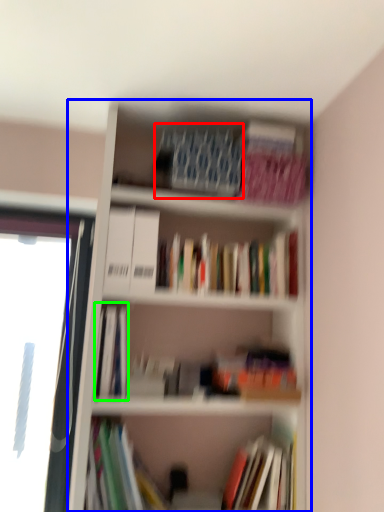
Question: Which is farther away from paperback book (highlighted by a red box)? bookcase (highlighted by a blue box) or book (highlighted by a green box)?

Choices:
 (A) bookcase
 (B) book

Answer: (B)